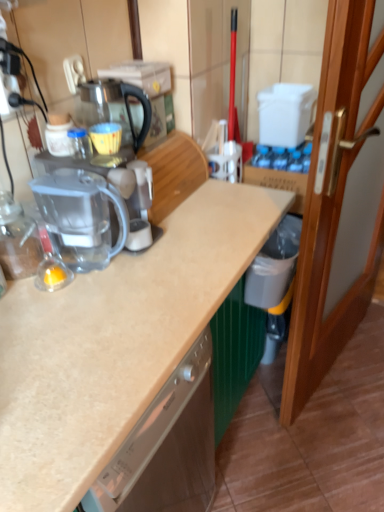
Identify the location of vacant region below wooden door at right (from a real-world perspective). (341, 374).